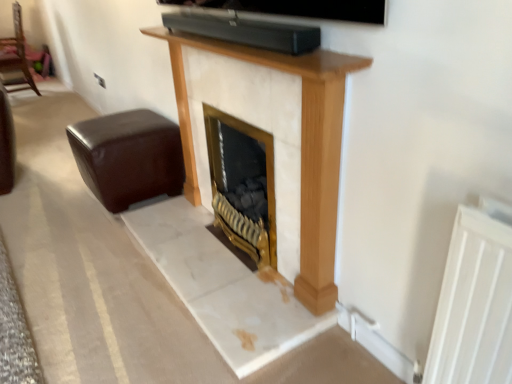
Question: From the image's perspective, is brown leather ottoman at left, acting as the second furniture starting from the right, above or below brown leather ottoman at lower left, acting as the 2th furniture starting from the top?

Choices:
 (A) below
 (B) above

Answer: (B)

Question: Is brown leather ottoman at left, which appears as the 2th furniture when ordered from the bottom, situated inside brown leather ottoman at lower left, acting as the 2th furniture starting from the top, or outside?

Choices:
 (A) inside
 (B) outside

Answer: (B)

Question: In terms of height, does brown leather ottoman at left, arranged as the 1th furniture when viewed from the back, look taller or shorter compared to brown leather ottoman at lower left, arranged as the first furniture when viewed from the right?

Choices:
 (A) short
 (B) tall

Answer: (B)

Question: From the image's perspective, is brown leather ottoman at lower left, placed as the 2th furniture when sorted from left to right, located above or below brown leather ottoman at left, acting as the second furniture starting from the right?

Choices:
 (A) above
 (B) below

Answer: (B)

Question: In the image, is brown leather ottoman at lower left, placed as the 2th furniture when sorted from left to right, positioned in front of or behind brown leather ottoman at left, which appears as the 2th furniture when ordered from the bottom?

Choices:
 (A) behind
 (B) front

Answer: (B)

Question: In terms of size, does brown leather ottoman at lower left, placed as the 2th furniture when sorted from left to right, appear bigger or smaller than brown leather ottoman at left, arranged as the 1th furniture when viewed from the back?

Choices:
 (A) small
 (B) big

Answer: (A)

Question: Is brown leather ottoman at lower left, acting as the 2th furniture starting from the top, taller or shorter than brown leather ottoman at left, the second furniture viewed from the front?

Choices:
 (A) short
 (B) tall

Answer: (A)